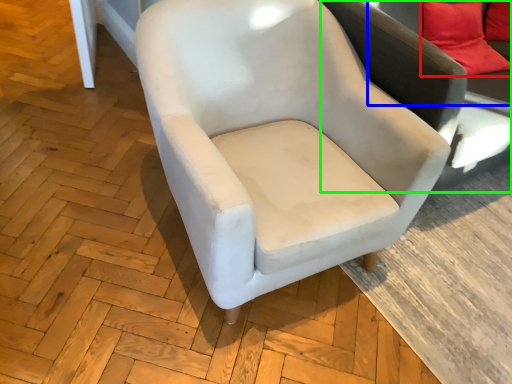
Question: Based on their relative distances, which object is nearer to pillow (highlighted by a red box)? Choose from couch (highlighted by a blue box) and swivel chair (highlighted by a green box).

Choices:
 (A) couch
 (B) swivel chair

Answer: (A)